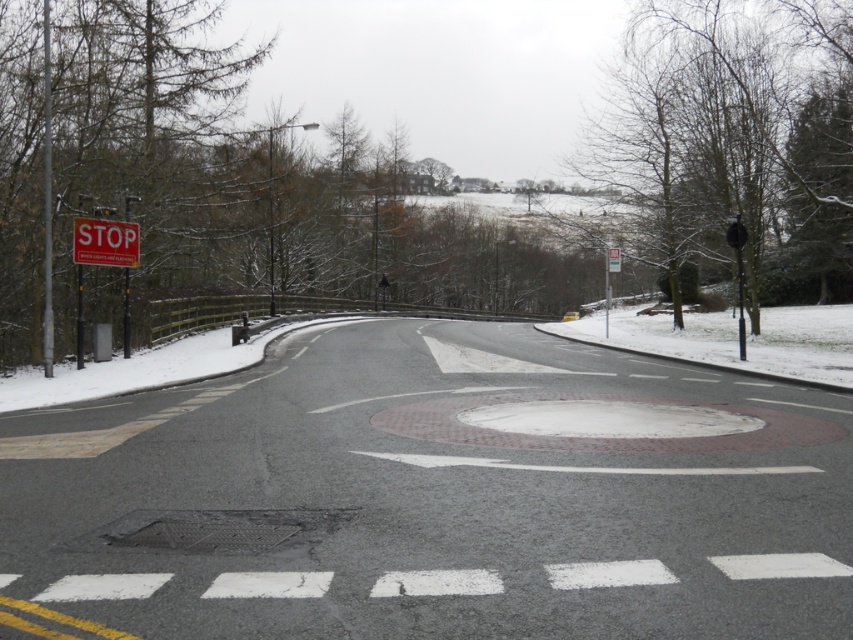
Question: In this image, where is red plastic stop sign at upper left located relative to metallic rectangular sign at upper center?

Choices:
 (A) below
 (B) above

Answer: (A)

Question: Can you confirm if red plastic stop sign at upper left is positioned above metallic rectangular sign at upper center?

Choices:
 (A) no
 (B) yes

Answer: (A)

Question: Which of the following is the closest to the observer?

Choices:
 (A) (614, 268)
 (B) (125, 241)

Answer: (B)

Question: Is red plastic stop sign at upper left smaller than metallic rectangular sign at upper center?

Choices:
 (A) yes
 (B) no

Answer: (A)